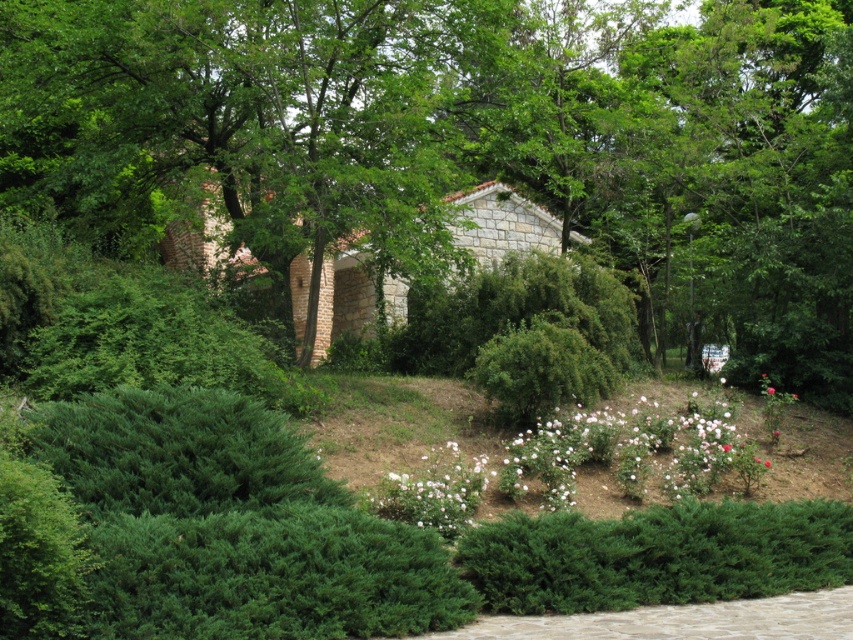
Question: Does green leafy tree at center have a larger size compared to green textured hedge at lower left?

Choices:
 (A) yes
 (B) no

Answer: (A)

Question: Can you confirm if green textured hedge at lower left is wider than green textured hedge at center?

Choices:
 (A) yes
 (B) no

Answer: (A)

Question: Which object is positioned closest to the green textured hedge at lower center?

Choices:
 (A) green textured hedge at center
 (B) green leafy tree at center

Answer: (A)

Question: Which object is the farthest from the pink matte rose at center?

Choices:
 (A) green leafy tree at center
 (B) white matte flowers at center
 (C) green textured hedge at lower left
 (D) green textured hedge at center

Answer: (C)

Question: Observing the image, what is the correct spatial positioning of green leafy tree at center in reference to white matte flowers at center?

Choices:
 (A) right
 (B) left

Answer: (B)

Question: Based on their relative distances, which object is farther from the green textured hedge at lower left?

Choices:
 (A) green textured hedge at lower center
 (B) green textured hedge at center
 (C) white matte flowers at center
 (D) green leafy tree at center

Answer: (D)